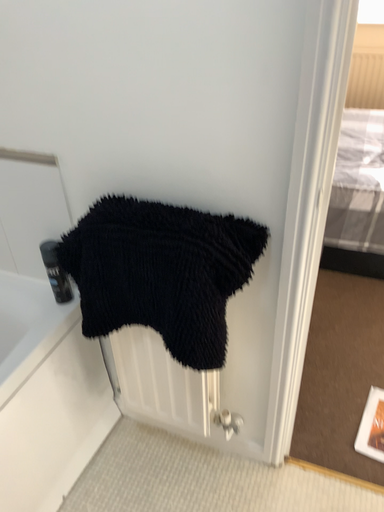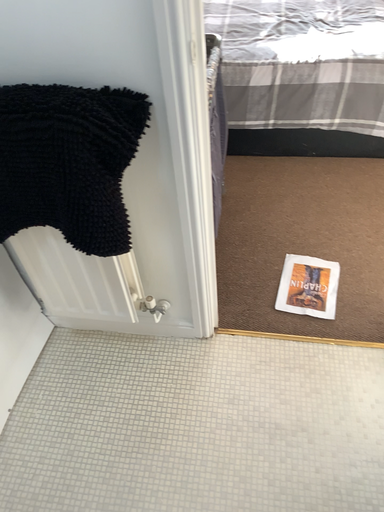
Question: How did the camera likely rotate when shooting the video?

Choices:
 (A) rotated downward
 (B) rotated upward

Answer: (A)